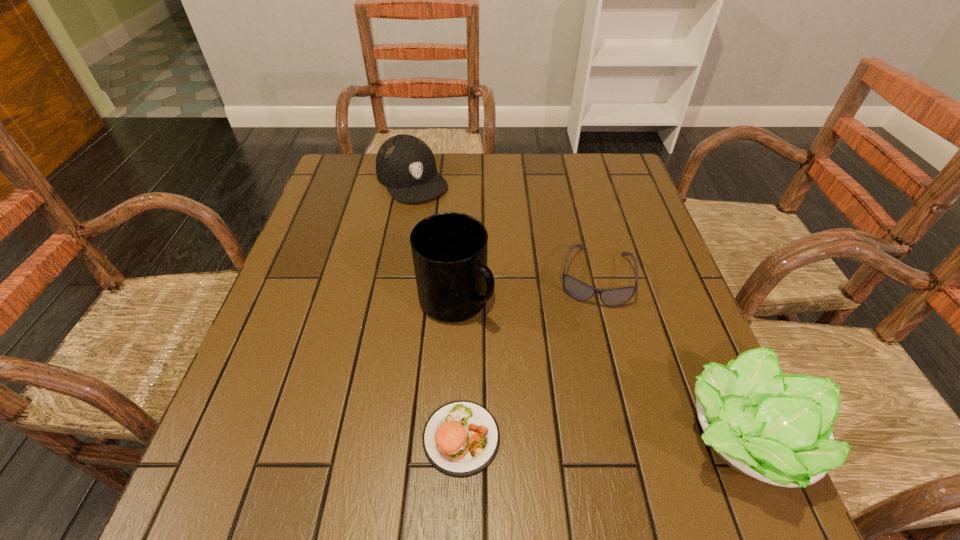
Where is `free space between the sunglasses and the shortest object`? Image resolution: width=960 pixels, height=540 pixels. free space between the sunglasses and the shortest object is located at coordinates (528, 357).

Image resolution: width=960 pixels, height=540 pixels. Identify the location of vacant space that's between the sunglasses and the farthest object. (504, 228).

Identify the location of free point between the fourth tallest object and the lettuce. (668, 357).

Locate an element on the screen. The height and width of the screenshot is (540, 960). vacant space that's between the lettuce and the cap is located at coordinates (577, 309).

At what (x,y) coordinates should I click in order to perform the action: click on vacant area that lies between the second shortest object and the tallest object. Please return your answer as a coordinate pair (x, y). This screenshot has height=540, width=960. Looking at the image, I should click on (525, 289).

Identify the location of unoccupied position between the lettuce and the patty. click(x=602, y=438).

Locate which object is the fourth closest to the shortest object. Please provide its 2D coordinates. Your answer should be formatted as a tuple, i.e. [(x, y)], where the tuple contains the x and y coordinates of a point satisfying the conditions above.

[(406, 165)]

Locate an element on the screen. The width and height of the screenshot is (960, 540). the fourth closest object relative to the lettuce is located at coordinates (406, 165).

The height and width of the screenshot is (540, 960). Find the location of `vacant space that satisfies the following two spatial constraints: 1. on the front side of the farthest object; 2. on the right side of the lettuce`. vacant space that satisfies the following two spatial constraints: 1. on the front side of the farthest object; 2. on the right side of the lettuce is located at coordinates (363, 438).

Locate an element on the screen. vacant space that satisfies the following two spatial constraints: 1. on the front side of the mug; 2. on the right side of the lettuce is located at coordinates (448, 438).